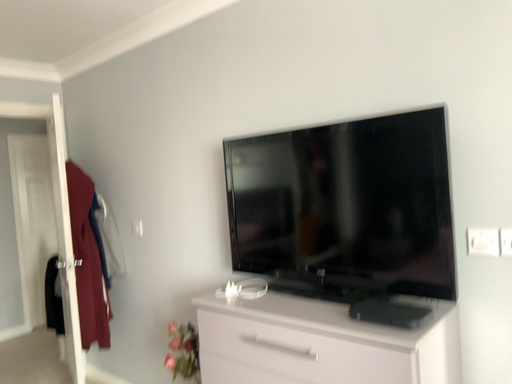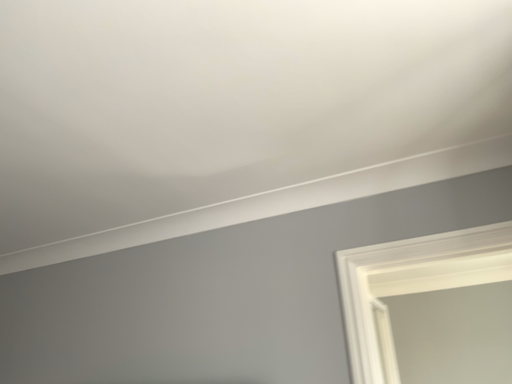
Question: How did the camera likely rotate when shooting the video?

Choices:
 (A) rotated right
 (B) rotated left

Answer: (A)